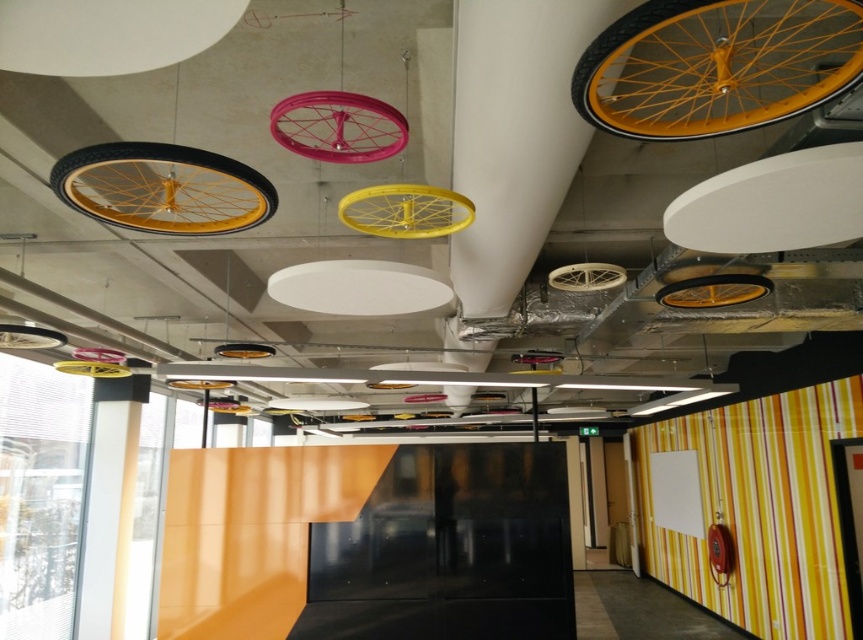
You are an interior designer planning to install a new light fixture between the matte yellow rimmed bicycle wheel at center and the pink metallic wheel at upper center. The new fixture requires a minimum of 24 inches of space between it and any existing fixtures. Based on the current spacing between the two wheels, is there enough space to safely install the new fixture?

The matte yellow rimmed bicycle wheel at center and pink metallic wheel at upper center are 26.91 inches apart from each other. Since the new fixture requires a minimum of 24 inches of space, there is enough space to safely install the new fixture between them.

You are an interior designer planning to install a new light fixture between the matte yellow rimmed bicycle wheel at center and the yellow matte bicycle wheel at center. Given that the fixture requires 30 inches of space to be safely installed, will there be enough space between them?

The distance between the matte yellow rimmed bicycle wheel at center and the yellow matte bicycle wheel at center is 28.93 inches, which is less than the required 30 inches. Therefore, there is not enough space to safely install the new light fixture between them.

Consider the image. You are an interior designer planning to hang a new artwork on the wall. You need to ensure it doesn not interfere with the yellow matte bicycle wheel at upper right. Where should you avoid placing the new artwork?

You should avoid placing the new artwork near the upper right area, specifically around the coordinates point [716,65] where the yellow matte bicycle wheel at upper right is located.